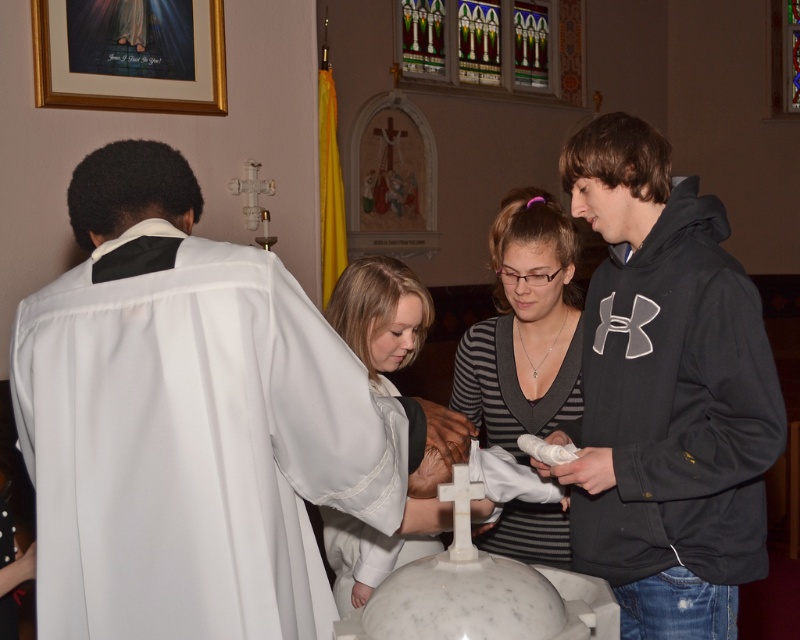
You are standing in the church and want to place a small flower vase between the two points, point (586, 563) and point (517, 346). Which point should the flower vase be closer to in order to be nearer to the baptismal font at the center?

The flower vase should be closer to point (517, 346) because it is farther from the viewer than point (586, 563), meaning it is closer to the baptismal font at the center.

You are an interior designer tasked with arranging furniture in this church scene. You need to place a new decorative item that is the same width as the white silk robe at left. Can you confirm if the white matte cross at center will fit in the same space?

The white silk robe at left is wider than the white matte cross at center, so the cross will fit in the space allocated for the robe since it is narrower.

In the scene of a religious ceremony inside a church, you see a white silk robe at left and a striped jersey at center. Which clothing item is shorter in height?

The white silk robe at left is shorter in height compared to the striped jersey at center.